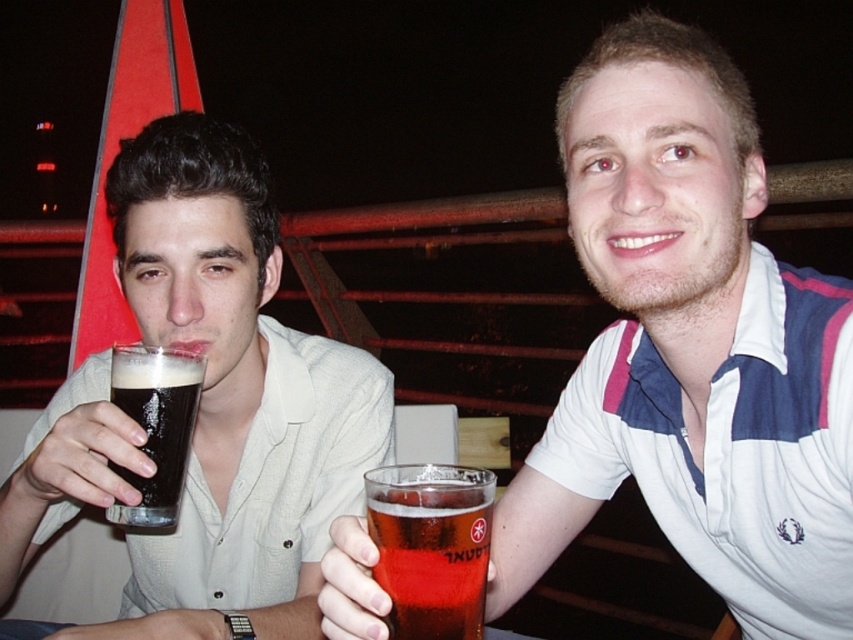
Question: In this image, where is matte black glass at left located relative to translucent glass beer at center?

Choices:
 (A) left
 (B) right

Answer: (A)

Question: Estimate the real-world distances between objects in this image. Which object is farther from the white cotton polo shirt at upper right?

Choices:
 (A) dark matte glass at left
 (B) translucent glass at center
 (C) matte black glass at left
 (D) translucent glass beer at center

Answer: (A)

Question: Can you confirm if matte black glass at left is positioned to the left of translucent glass beer at center?

Choices:
 (A) yes
 (B) no

Answer: (A)

Question: Among these objects, which one is farthest from the camera?

Choices:
 (A) translucent glass at center
 (B) dark matte glass at left

Answer: (B)

Question: Which point is closer to the camera?

Choices:
 (A) matte black glass at left
 (B) white cotton polo shirt at upper right
 (C) dark matte glass at left

Answer: (B)

Question: Does matte black glass at left have a larger size compared to translucent glass beer at center?

Choices:
 (A) yes
 (B) no

Answer: (A)